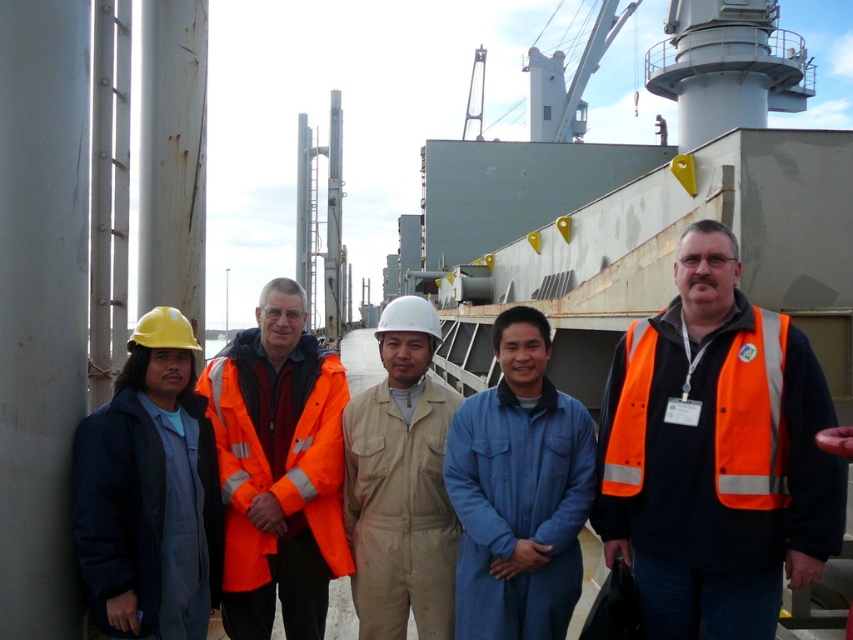
Can you confirm if blue cotton coverall at center is taller than orange reflective safety vest at right?

Correct, blue cotton coverall at center is much taller as orange reflective safety vest at right.

Between blue cotton coverall at center and orange reflective safety vest at right, which one has more height?

Standing taller between the two is blue cotton coverall at center.

Is point (509, 572) behind point (636, 422)?

That is True.

Identify the location of blue cotton coverall at center. (519, 492).

Who is more distant from viewer, (640, 508) or (735, 346)?

Point (640, 508)

Does orange reflective vest at center appear on the right side of orange reflective safety vest at right?

Yes, orange reflective vest at center is to the right of orange reflective safety vest at right.

You are a GUI agent. You are given a task and a screenshot of the screen. Output one action in this format:
    pyautogui.click(x=<x>, y=<y>)
    Task: Click on the orange reflective vest at center
    
    Given the screenshot: What is the action you would take?
    pyautogui.click(x=715, y=454)

Who is more forward, (x=178, y=493) or (x=759, y=449)?

Positioned in front is point (x=759, y=449).

Who is more distant from viewer, (202, 557) or (776, 492)?

The point (202, 557) is more distant.

Locate an element on the screen. This screenshot has height=640, width=853. matte blue coveralls at left is located at coordinates [149, 492].